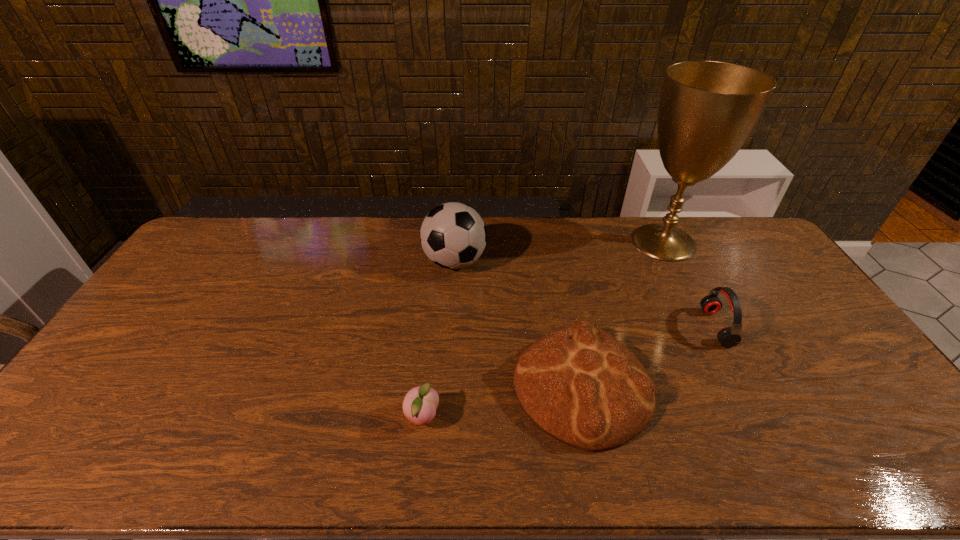
At what (x,y) coordinates should I click in order to perform the action: click on blank area located on the right of the third object from right to left. Please return your answer as a coordinate pair (x, y). Looking at the image, I should click on (736, 387).

At what (x,y) coordinates should I click in order to perform the action: click on vacant position located 0.380m on the back of the peach. Please return your answer as a coordinate pair (x, y). This screenshot has height=540, width=960. Looking at the image, I should click on (435, 298).

Image resolution: width=960 pixels, height=540 pixels. I want to click on trophy cup present at the far edge, so click(708, 109).

The height and width of the screenshot is (540, 960). Find the location of `soccer ball present at the far edge`. soccer ball present at the far edge is located at coordinates (453, 235).

Where is `object positioned at the near edge`? The width and height of the screenshot is (960, 540). object positioned at the near edge is located at coordinates (582, 386).

Locate an element on the screen. The width and height of the screenshot is (960, 540). vacant space at the far edge of the desktop is located at coordinates (612, 244).

Locate an element on the screen. The height and width of the screenshot is (540, 960). free point at the near edge is located at coordinates [277, 442].

The image size is (960, 540). In the image, there is a desktop. What are the coordinates of `vacant space at the left edge` in the screenshot? It's located at pyautogui.click(x=172, y=339).

In the image, there is a desktop. Identify the location of vacant area at the right edge. This screenshot has height=540, width=960. (842, 357).

Where is `vacant area at the far right corner`? vacant area at the far right corner is located at coordinates point(731,244).